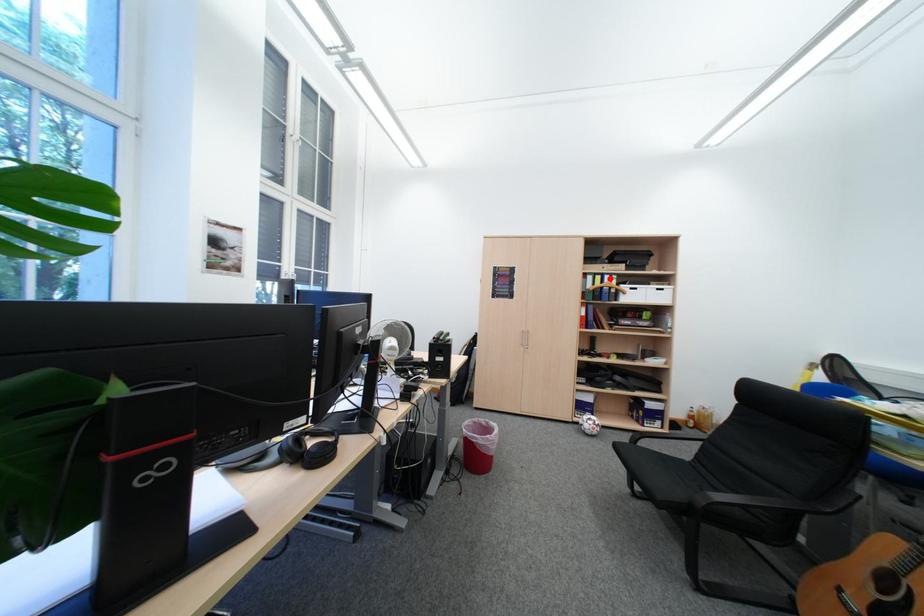
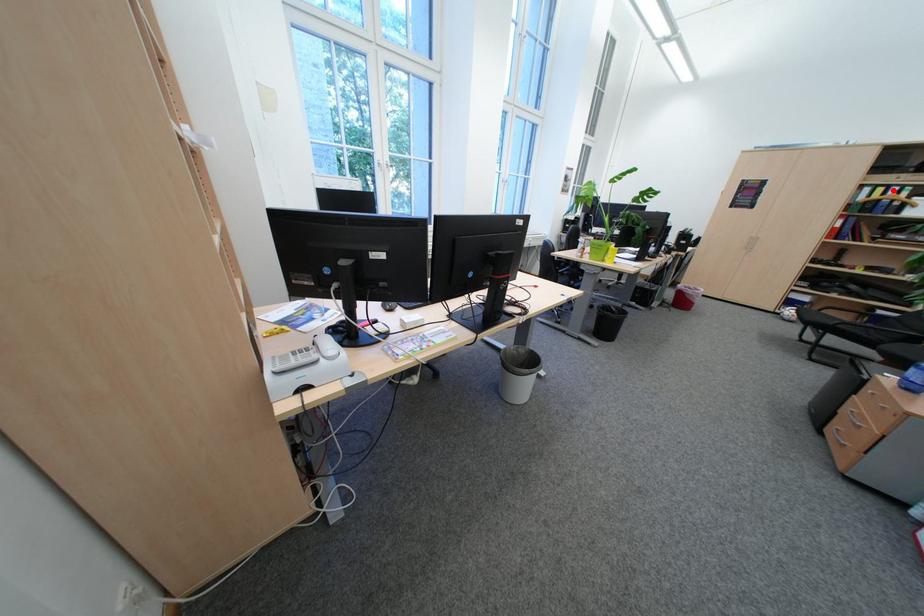
I am providing you with two images of the same scene from different viewpoints. A red point is marked on the first image and another point is marked on the second image. Are the points marked in image1 and image2 representing the same 3D position?

Yes